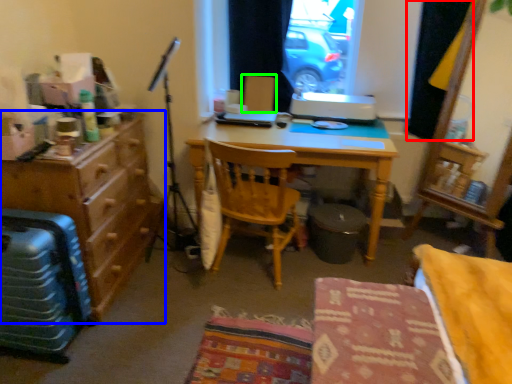
Question: Considering the real-world distances, which object is closest to curtain (highlighted by a red box)? cabinetry (highlighted by a blue box) or armchair (highlighted by a green box).

Choices:
 (A) cabinetry
 (B) armchair

Answer: (B)